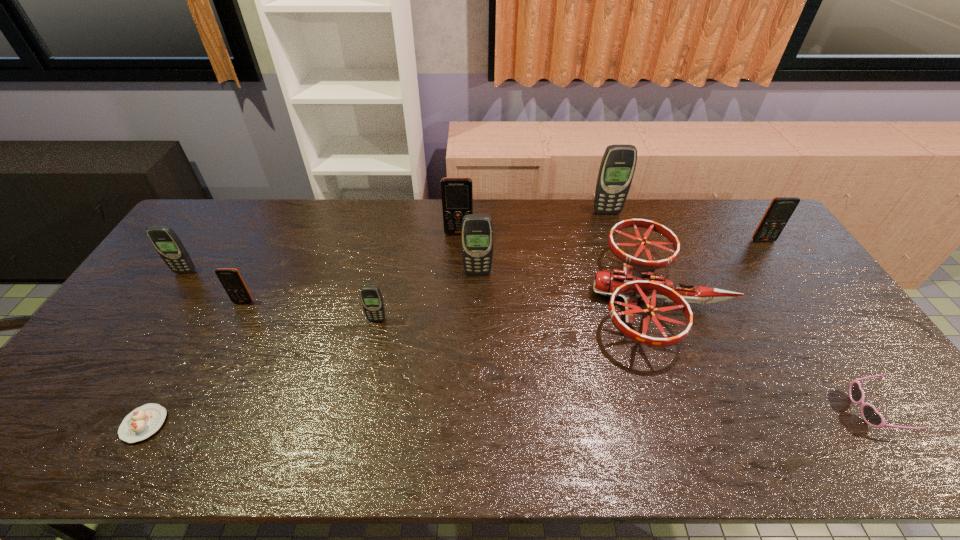
This screenshot has height=540, width=960. Identify the location of sunglasses located at the near edge. (871, 416).

Identify the location of cupcake that is positioned at the near edge. Image resolution: width=960 pixels, height=540 pixels. (142, 422).

Image resolution: width=960 pixels, height=540 pixels. Find the location of `object that is positioned at the left edge`. object that is positioned at the left edge is located at coordinates (166, 242).

Locate an element on the screen. The height and width of the screenshot is (540, 960). cellular telephone located at the right edge is located at coordinates (781, 208).

Image resolution: width=960 pixels, height=540 pixels. What are the coordinates of `sunglasses that is at the right edge` in the screenshot? It's located at (871, 416).

Where is `object located in the far right corner section of the desktop`? object located in the far right corner section of the desktop is located at coordinates (781, 208).

Find the location of a particular element. object that is positioned at the near right corner is located at coordinates (871, 416).

The width and height of the screenshot is (960, 540). In order to click on vacant space at the far edge of the desktop in this screenshot , I will do `click(271, 213)`.

In the image, there is a desktop. Where is `vacant space at the near edge`? vacant space at the near edge is located at coordinates (174, 431).

In order to click on vacant space at the left edge of the desktop in this screenshot , I will do `click(160, 268)`.